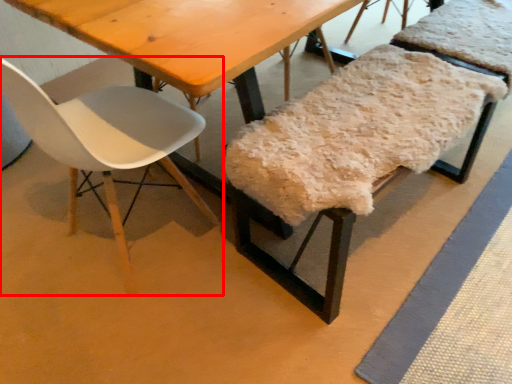
Question: Observing the image, what is the correct spatial positioning of chair (annotated by the red box) in reference to chair?

Choices:
 (A) right
 (B) left

Answer: (B)